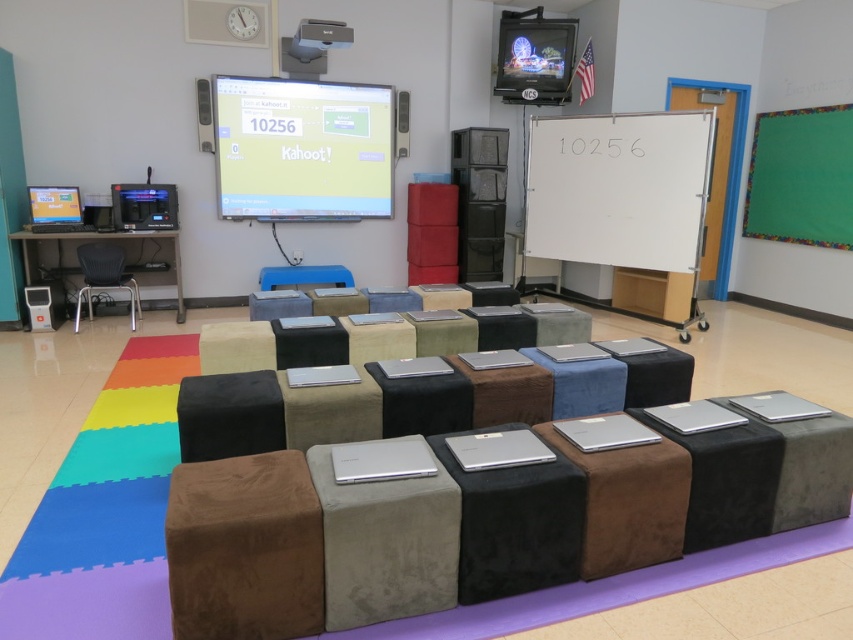
You are a teacher planning to hang a new poster in the classroom. The poster is as wide as the green felt board at upper right. Will it fit on the white matte whiteboard at center?

The white matte whiteboard at center is wider than the green felt board at upper right. Since the poster is as wide as the green felt board at upper right, it will fit on the white matte whiteboard at center because its width is sufficient to accommodate the poster.

You are a teacher preparing to show a presentation in the classroom. You need to ensure that the projector has a clear path to the screen. Based on the scene described, will the matte black projector at upper center be able to project an image onto the matte plastic projector screen at upper center without obstruction?

The matte black projector at upper center is behind the matte plastic projector screen at upper center, so it can project an image onto the screen without any obstruction.

You are standing at the center of the classroom and want to move to the brown suede stool at lower left. Which direction should you move in?

Since the brown suede stool at lower left is located at coordinates approximately 0.858 on the x axis and 0.287 on the y axis, you should move towards the lower left direction to reach it.